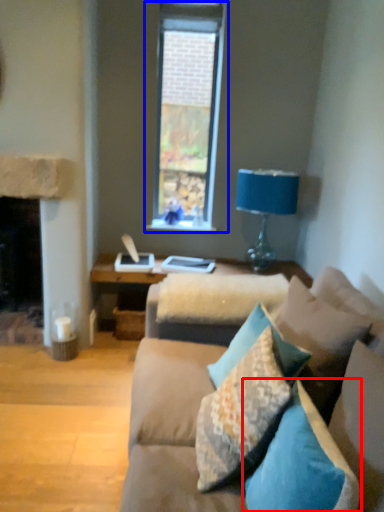
Question: Which point is further to the camera, pillow (highlighted by a red box) or window (highlighted by a blue box)?

Choices:
 (A) pillow
 (B) window

Answer: (B)